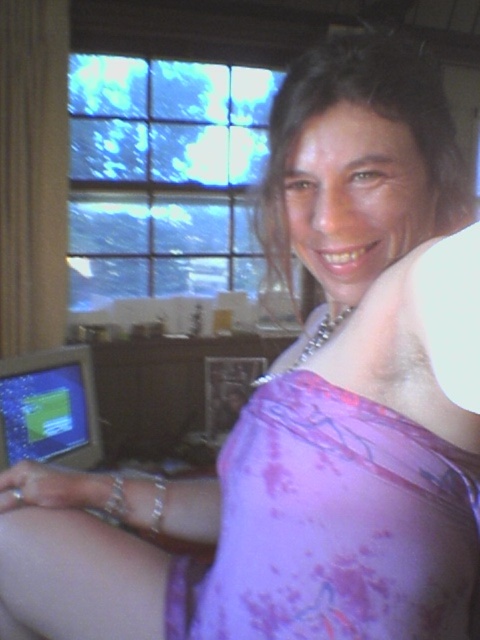
Consider the image. Is purple satin dress at center bigger than matte plastic monitor at lower left?

Yes, purple satin dress at center is bigger than matte plastic monitor at lower left.

This screenshot has width=480, height=640. Identify the location of purple satin dress at center. (334, 525).

Which is in front, point (315, 618) or point (12, 448)?

Positioned in front is point (315, 618).

This screenshot has width=480, height=640. Identify the location of purple satin dress at center. (334, 525).